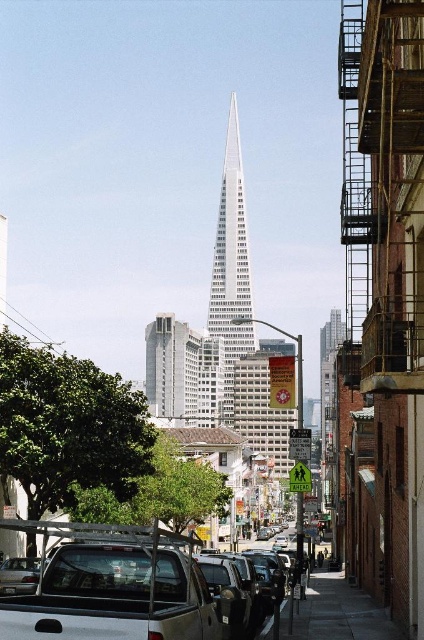
Question: Does white matte truck at lower left come in front of dark gray concrete sidewalk at lower center?

Choices:
 (A) no
 (B) yes

Answer: (B)

Question: Considering the real-world distances, which object is closest to the dark gray concrete sidewalk at lower center?

Choices:
 (A) white glass skyscraper at center
 (B) white matte truck at lower left

Answer: (B)

Question: Among these points, which one is nearest to the camera?

Choices:
 (A) (359, 618)
 (B) (102, 568)
 (C) (217, 308)

Answer: (B)

Question: Which point is closer to the camera taking this photo?

Choices:
 (A) (147, 532)
 (B) (245, 268)

Answer: (A)

Question: Is white glass skyscraper at center wider than dark gray concrete sidewalk at lower center?

Choices:
 (A) yes
 (B) no

Answer: (A)

Question: Is white glass skyscraper at center above dark gray concrete sidewalk at lower center?

Choices:
 (A) no
 (B) yes

Answer: (B)